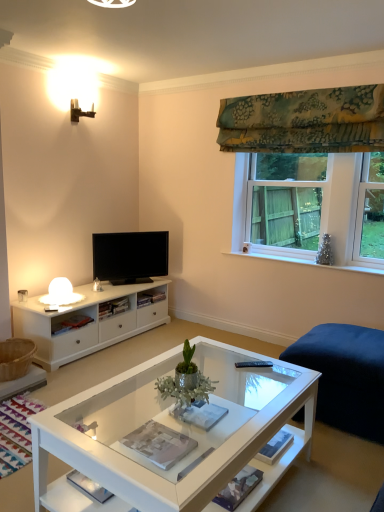
Question: Is black glossy tv at center inside or outside of green metallic plant at center?

Choices:
 (A) outside
 (B) inside

Answer: (A)

Question: From the image's perspective, is black glossy tv at center located above or below green metallic plant at center?

Choices:
 (A) above
 (B) below

Answer: (A)

Question: Estimate the real-world distances between objects in this image. Which object is closer to the white glass coffee table at center?

Choices:
 (A) green floral fabric at upper right
 (B) clear glass window at upper right
 (C) black glossy tv at center
 (D) green metallic plant at center

Answer: (D)

Question: Which is nearer to the white glass coffee table at center?

Choices:
 (A) clear glass window at upper right
 (B) black glossy tv at center
 (C) green metallic plant at center
 (D) green floral fabric at upper right

Answer: (C)